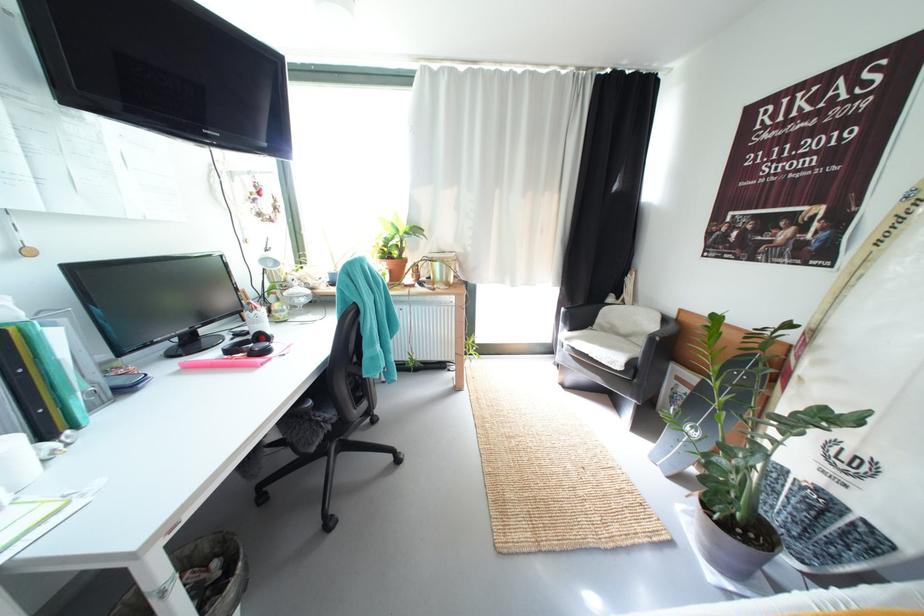
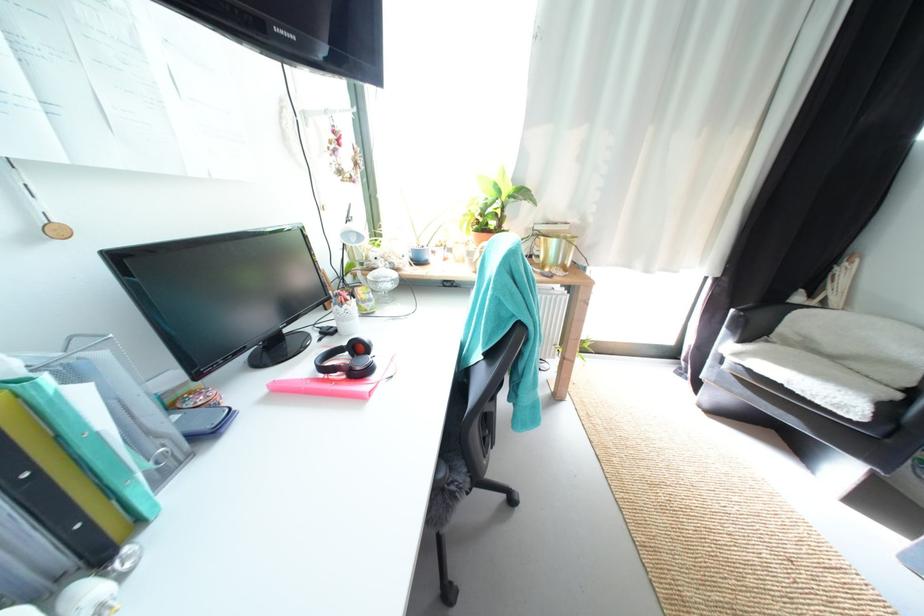
Question: How did the camera likely rotate?

Choices:
 (A) Left
 (B) Right
 (C) Up
 (D) Down

Answer: (A)